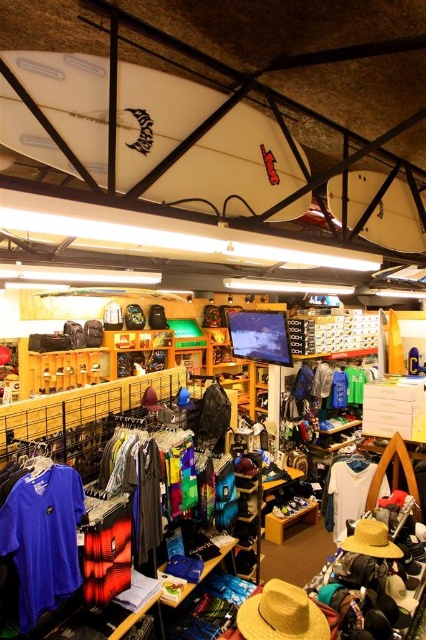
Does matte blue t-shirt at center have a greater height compared to white matte t-shirt at center?

Indeed, matte blue t-shirt at center has a greater height compared to white matte t-shirt at center.

Can you confirm if matte blue t-shirt at center is positioned below white matte t-shirt at center?

Incorrect, matte blue t-shirt at center is not positioned below white matte t-shirt at center.

Does point (37, 506) come farther from viewer compared to point (327, 528)?

No, it is in front of (327, 528).

In order to click on matte blue t-shirt at center in this screenshot , I will do pyautogui.click(x=43, y=538).